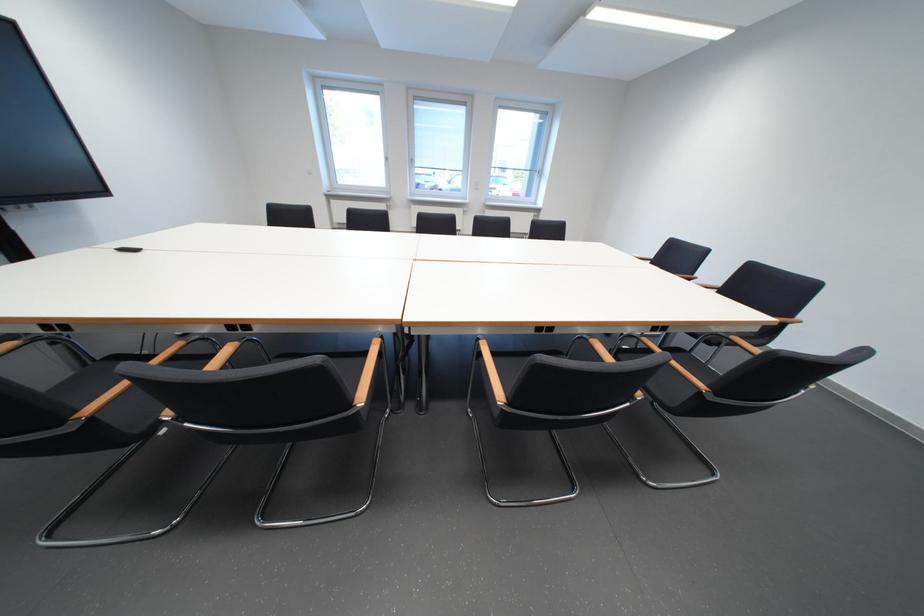
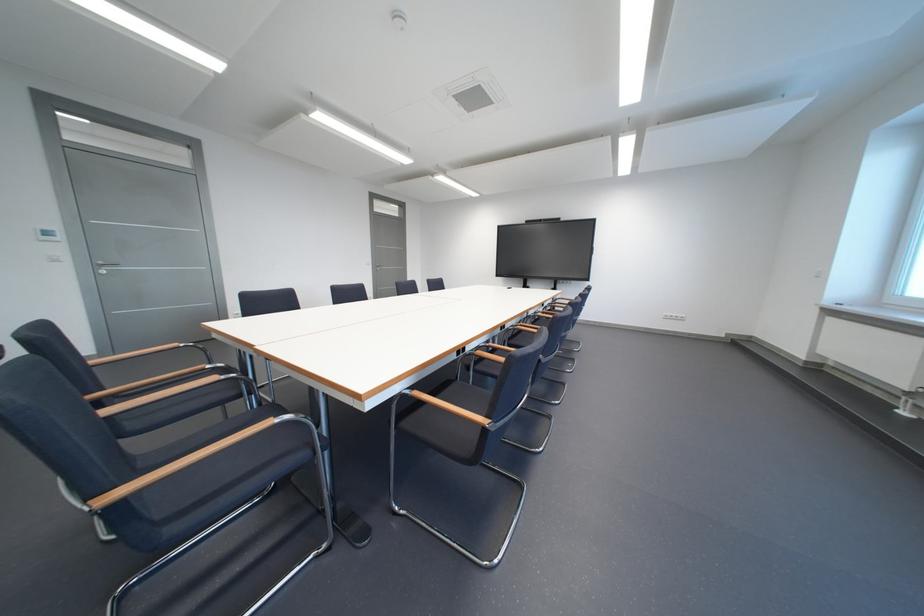
Question: I am providing you with two images of the same scene from different viewpoints. Which of the following objects are not visible in image2?

Choices:
 (A) blue foam block
 (B) wooden chair armrest
 (C) white light switch
 (D) chair sitting surface

Answer: (D)